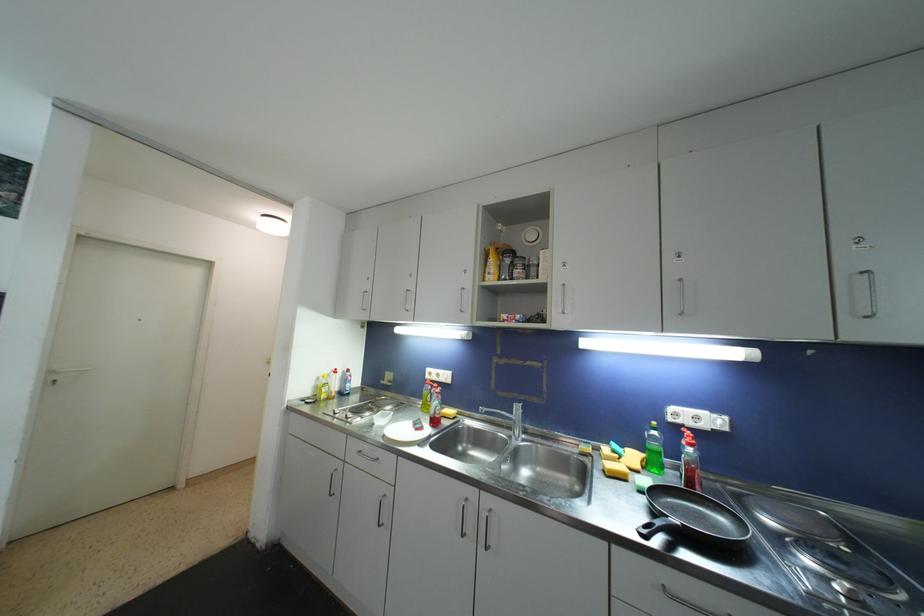
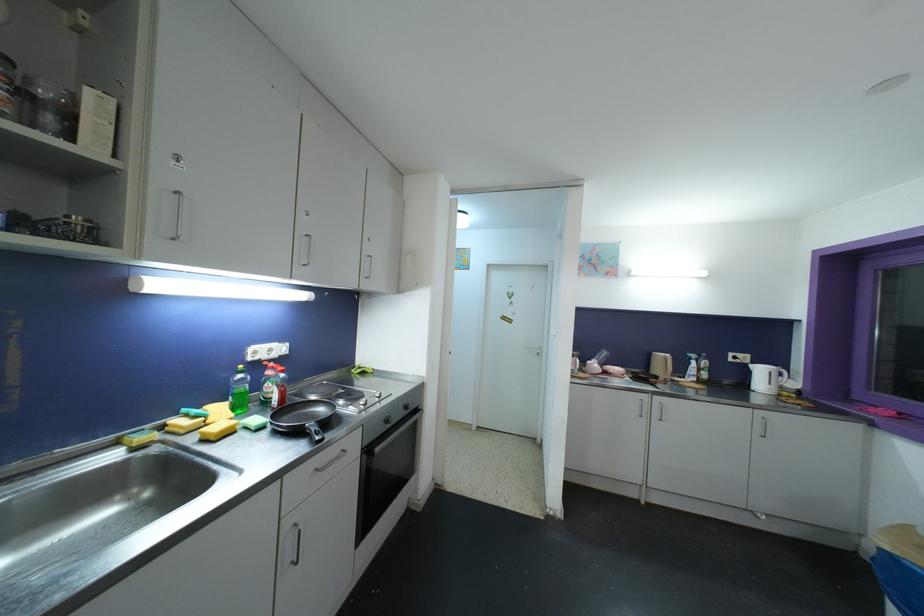
Find the pixel in the second image that matches point (648, 533) in the first image.

(321, 440)